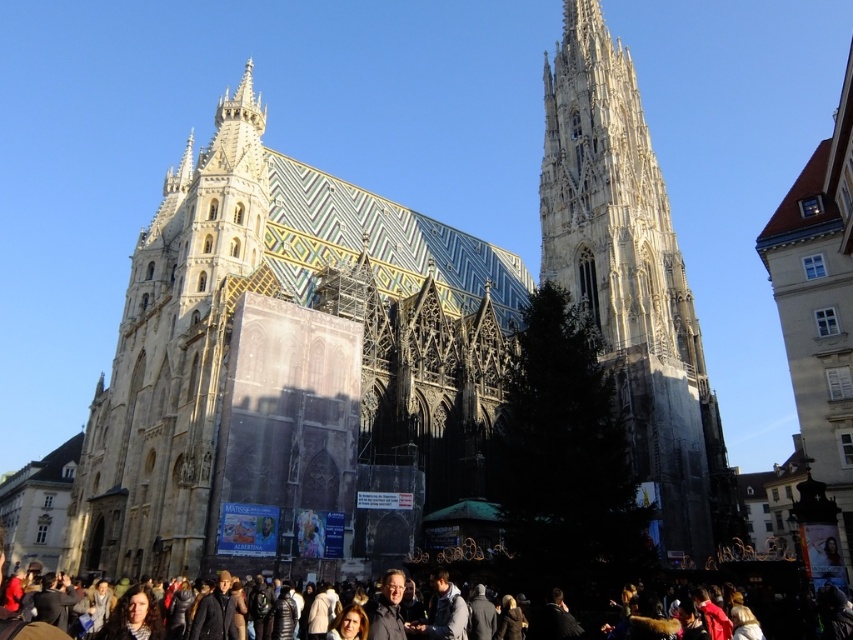
Which is below, white stone tower at center or dark gray clothing at center?

dark gray clothing at center is below.

What do you see at coordinates (631, 282) in the screenshot? The height and width of the screenshot is (640, 853). I see `white stone tower at center` at bounding box center [631, 282].

Find the location of `white stone tower at center`. white stone tower at center is located at coordinates (631, 282).